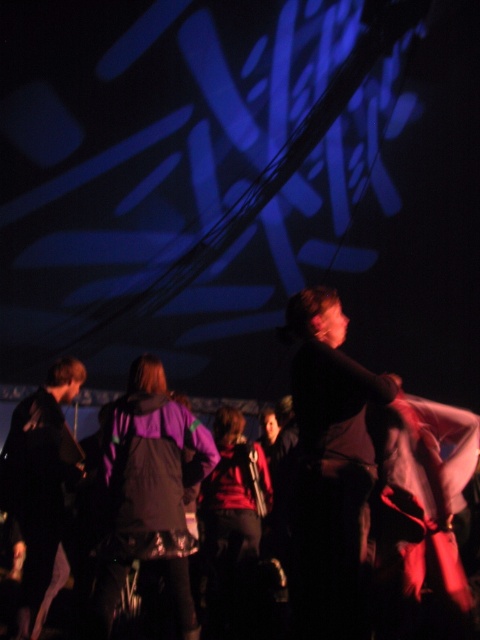
You are a photographer trying to capture a group photo of the dark fabric shirt at center and the purple matte jacket at center. Which one of the two is shorter in height?

The dark fabric shirt at center has a lesser height compared to the purple matte jacket at center, so the dark fabric shirt at center is shorter in height.